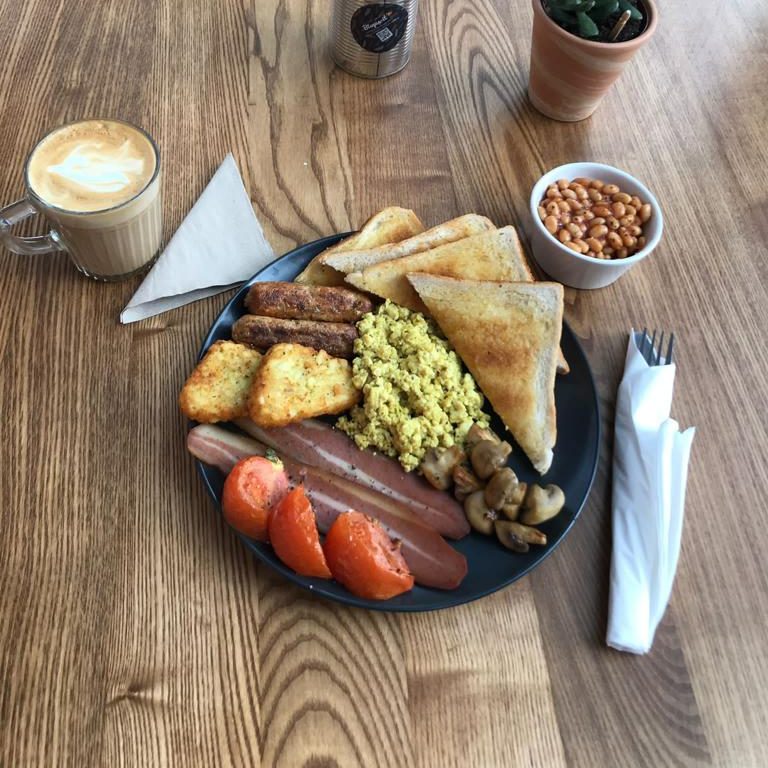
You are a GUI agent. You are given a task and a screenshot of the screen. Output one action in this format:
    pyautogui.click(x=<x>, y=<y>)
    Task: Click on the napkin folded in half
    This screenshot has height=768, width=768.
    Given the screenshot: What is the action you would take?
    pyautogui.click(x=217, y=237)